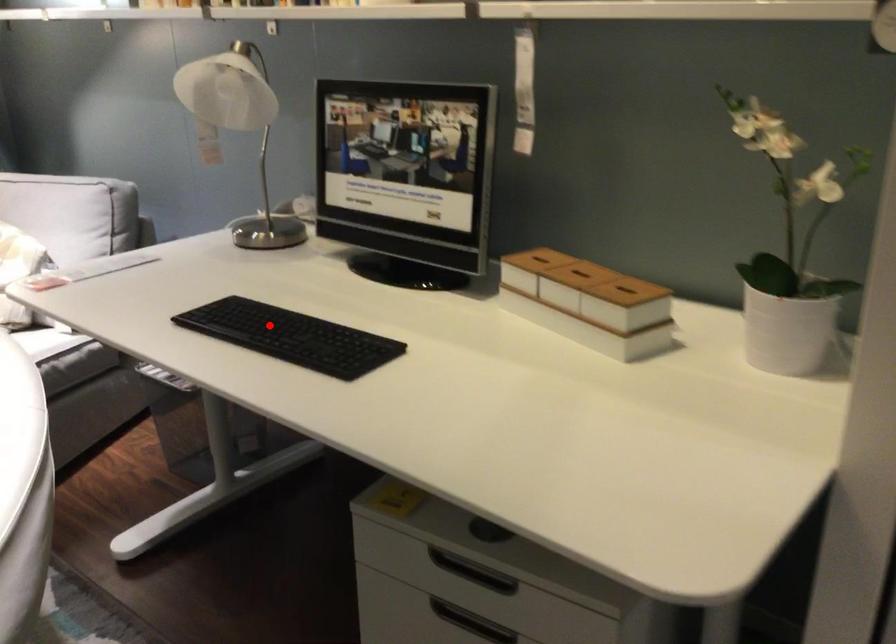
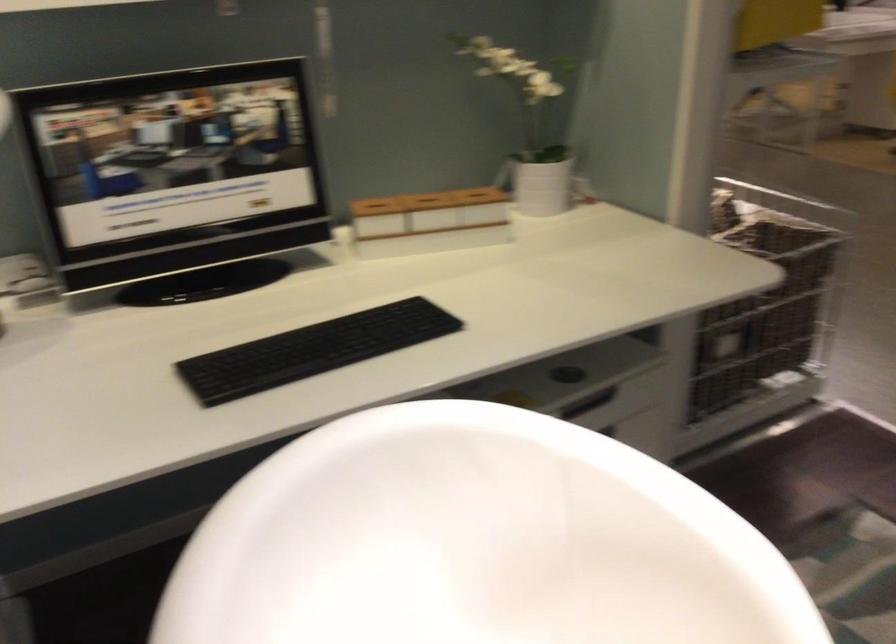
Where in the second image is the point corresponding to the highlighted location from the first image?

(313, 350)